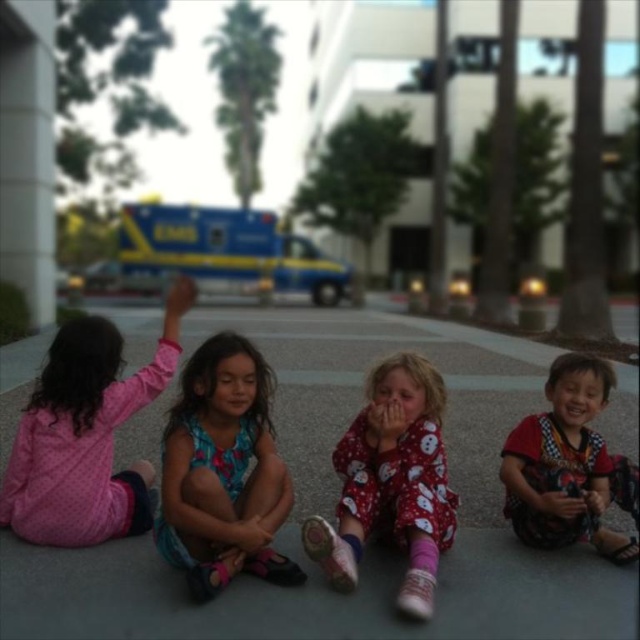
Question: Considering the real-world distances, which object is farthest from the red pajama at center?

Choices:
 (A) gray concrete pavement at center
 (B) blue floral dress at center
 (C) pink polka dot pajamas at left
 (D) blue metallic ambulance at upper center

Answer: (D)

Question: Which is farther from the pink polka dot pajamas at left?

Choices:
 (A) blue floral dress at center
 (B) printed fabric shirt at lower right
 (C) red pajama at center
 (D) blue metallic ambulance at upper center

Answer: (D)

Question: Can you confirm if pink polka dot pajamas at left is wider than printed fabric shirt at lower right?

Choices:
 (A) yes
 (B) no

Answer: (A)

Question: Is blue floral dress at center thinner than red pajama at center?

Choices:
 (A) yes
 (B) no

Answer: (A)

Question: Does gray concrete pavement at center come in front of printed fabric shirt at lower right?

Choices:
 (A) no
 (B) yes

Answer: (B)

Question: Which object appears closest to the camera in this image?

Choices:
 (A) blue metallic ambulance at upper center
 (B) red pajama at center
 (C) blue floral dress at center
 (D) gray concrete pavement at center

Answer: (D)